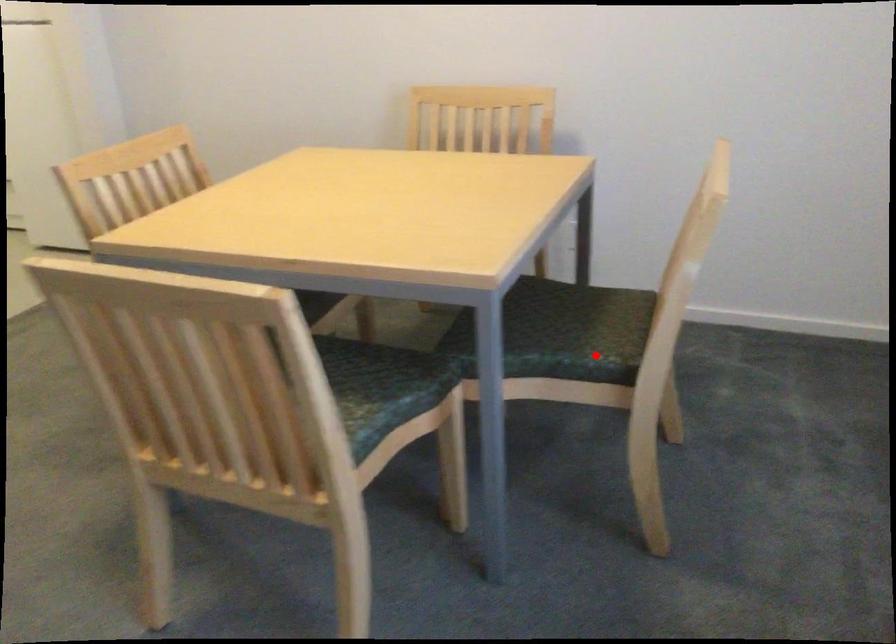
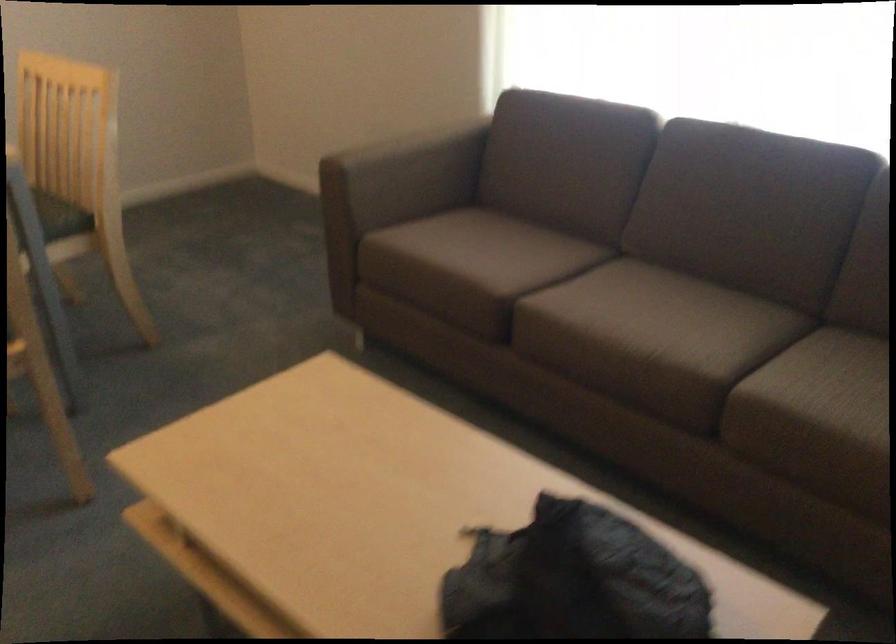
Question: I am providing you with two images of the same scene from different viewpoints. Image1 has a red point marked. In image2, the corresponding 3D location appears at what relative position? Reply with the corresponding letter.

Choices:
 (A) Closer
 (B) Farther

Answer: (B)